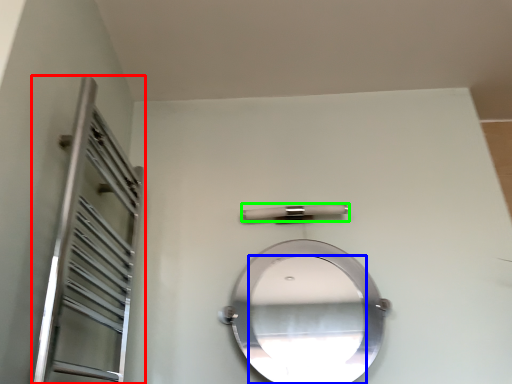
Question: Which object is the farthest from screen door (highlighted by a red box)? Choose among these: mirror (highlighted by a blue box) or door handle (highlighted by a green box).

Choices:
 (A) mirror
 (B) door handle

Answer: (A)